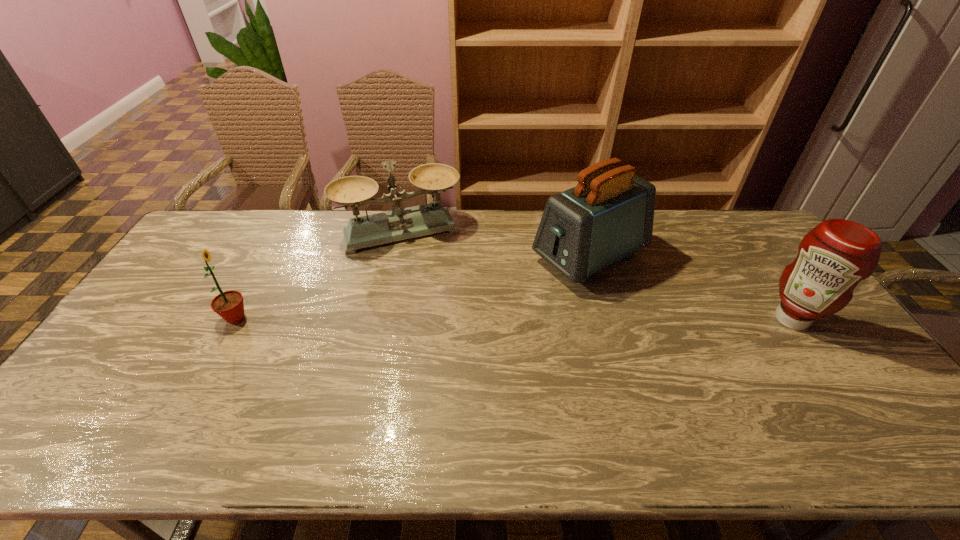
The height and width of the screenshot is (540, 960). Identify the location of vacant spot on the desktop that is between the leftmost object and the condiment and is positioned on the front-facing side of the toaster. (467, 319).

At what (x,y) coordinates should I click in order to perform the action: click on vacant space on the desktop that is between the leftmost object and the rightmost object and is positioned on the front-facing side of the third object from right to left. Please return your answer as a coordinate pair (x, y). Looking at the image, I should click on click(432, 319).